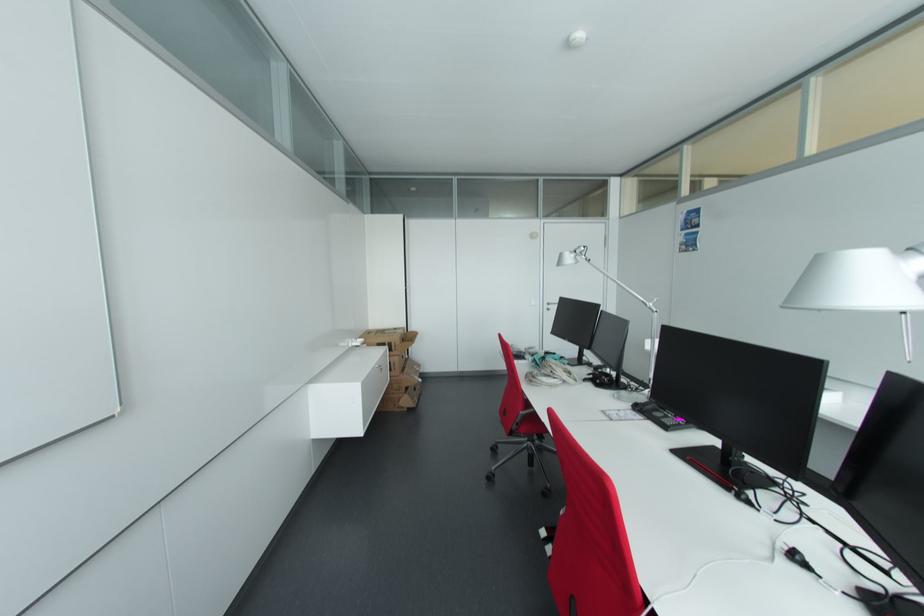
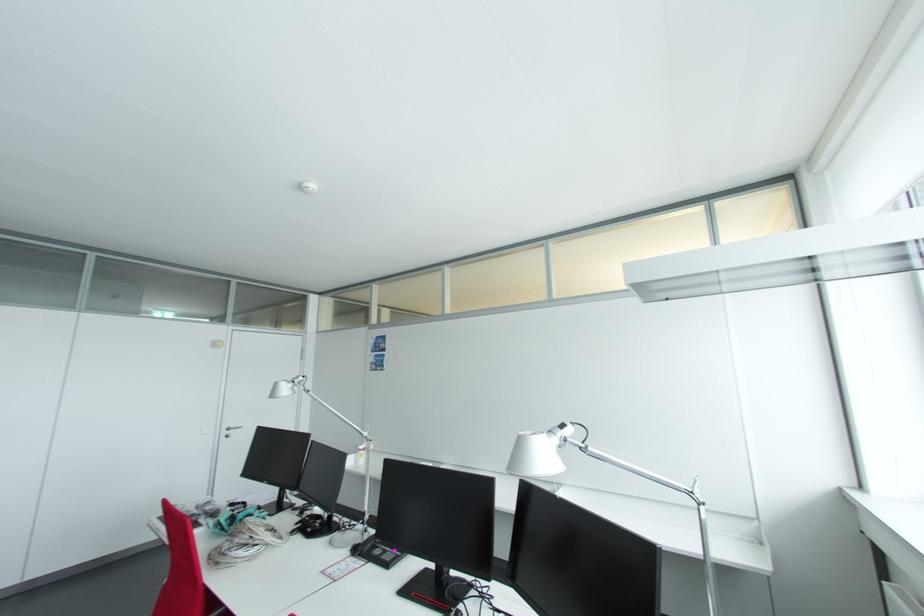
In the second image, find the point that corresponds to (640,408) in the first image.

(359, 552)